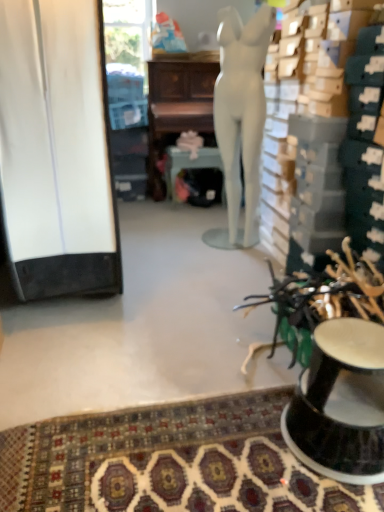
Locate an element on the screen. This screenshot has height=512, width=384. vacant area that lies in front of white matte mannequin at center is located at coordinates (224, 265).